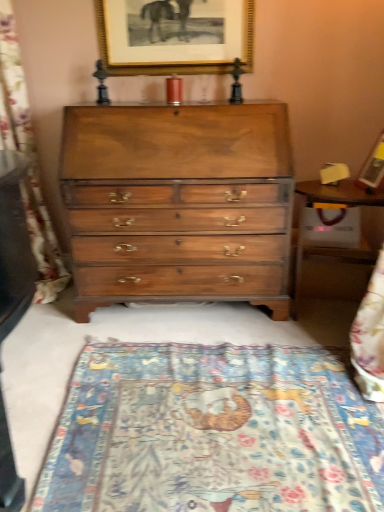
Question: Is wooden picture frame at upper right, which is the first picture frame from front to back, at the right side of shiny brown wood chest of drawers at center?

Choices:
 (A) no
 (B) yes

Answer: (B)

Question: From the image's perspective, is wooden picture frame at upper right, the 1th picture frame from the bottom, over shiny brown wood chest of drawers at center?

Choices:
 (A) yes
 (B) no

Answer: (A)

Question: Is wooden picture frame at upper right, the 1th picture frame from the bottom, not near shiny brown wood chest of drawers at center?

Choices:
 (A) no
 (B) yes

Answer: (A)

Question: Does wooden picture frame at upper right, which is the first picture frame from front to back, have a larger size compared to shiny brown wood chest of drawers at center?

Choices:
 (A) yes
 (B) no

Answer: (B)

Question: Is wooden picture frame at upper right, which is the first picture frame from front to back, oriented towards shiny brown wood chest of drawers at center?

Choices:
 (A) no
 (B) yes

Answer: (B)

Question: Does wooden picture frame at upper right, the second picture frame from the back, have a smaller size compared to shiny brown wood chest of drawers at center?

Choices:
 (A) no
 (B) yes

Answer: (B)

Question: From a real-world perspective, is blue woven tapestry at left on wooden picture frame at upper right, the second picture frame when ordered from left to right?

Choices:
 (A) yes
 (B) no

Answer: (B)

Question: From the image's perspective, would you say blue woven tapestry at left is shown under wooden picture frame at upper right, the second picture frame from the back?

Choices:
 (A) yes
 (B) no

Answer: (B)

Question: Can you confirm if blue woven tapestry at left is positioned to the right of wooden picture frame at upper right, which is the 1th picture frame from right to left?

Choices:
 (A) no
 (B) yes

Answer: (A)

Question: From the image's perspective, is blue woven tapestry at left located above wooden picture frame at upper right, which appears as the second picture frame when viewed from the top?

Choices:
 (A) no
 (B) yes

Answer: (B)

Question: Considering the relative sizes of blue woven tapestry at left and wooden picture frame at upper right, which appears as the second picture frame when viewed from the top, in the image provided, is blue woven tapestry at left thinner than wooden picture frame at upper right, which appears as the second picture frame when viewed from the top,?

Choices:
 (A) no
 (B) yes

Answer: (A)

Question: Is blue woven tapestry at left aimed at wooden picture frame at upper right, which is the 1th picture frame from right to left?

Choices:
 (A) no
 (B) yes

Answer: (A)

Question: Does wooden table at right contain blue woven tapestry at left?

Choices:
 (A) yes
 (B) no

Answer: (B)